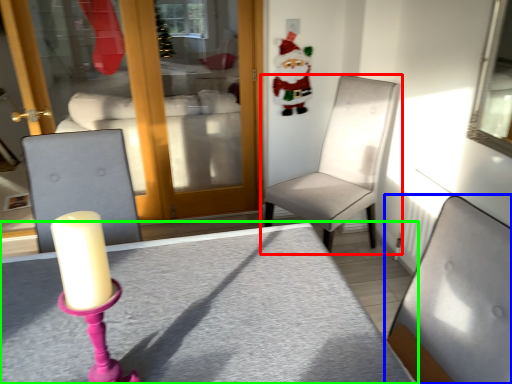
Question: Based on their relative distances, which object is farther from chair (highlighted by a red box)? Choose from chair (highlighted by a blue box) and table (highlighted by a green box).

Choices:
 (A) chair
 (B) table

Answer: (A)